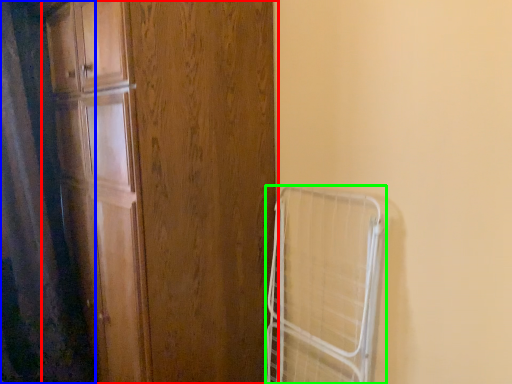
Question: Which object is positioned farthest from door (highlighted by a red box)? Select from shower curtain (highlighted by a blue box) and cage (highlighted by a green box).

Choices:
 (A) shower curtain
 (B) cage

Answer: (A)